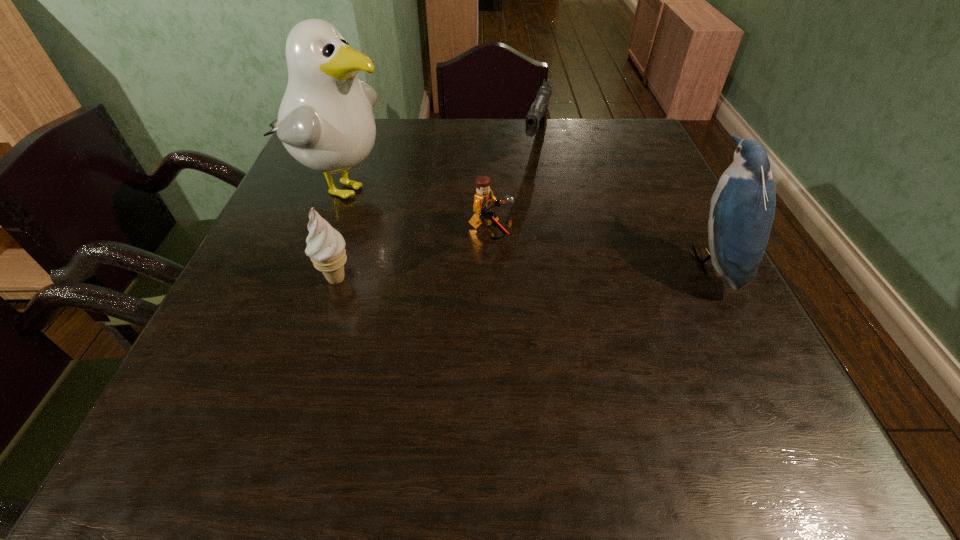
The height and width of the screenshot is (540, 960). In order to click on vacant area situated in the direction the fourth object from left to right is aimed in this screenshot , I will do `click(525, 186)`.

Locate an element on the screen. vacant space located 0.310m in the direction the fourth object from left to right is aimed is located at coordinates (506, 237).

Where is `free spot located 0.120m in the direction the fourth object from left to right is aimed`? free spot located 0.120m in the direction the fourth object from left to right is aimed is located at coordinates (524, 188).

Locate an element on the screen. The image size is (960, 540). free space located holding a crossbow in the hands of the Lego is located at coordinates (588, 276).

Where is `free space located 0.250m holding a crossbow in the hands of the Lego`? The width and height of the screenshot is (960, 540). free space located 0.250m holding a crossbow in the hands of the Lego is located at coordinates (622, 291).

The width and height of the screenshot is (960, 540). In order to click on vacant space located holding a crossbow in the hands of the Lego in this screenshot , I will do `click(534, 254)`.

Where is `vacant point located on the beak of the tallest object`? This screenshot has width=960, height=540. vacant point located on the beak of the tallest object is located at coordinates (417, 212).

What are the coordinates of `free location located on the beak of the tallest object` in the screenshot? It's located at (489, 238).

Image resolution: width=960 pixels, height=540 pixels. What are the coordinates of `vacant space located on the beak of the tallest object` in the screenshot? It's located at (514, 247).

Image resolution: width=960 pixels, height=540 pixels. Identify the location of gun that is at the far edge. (536, 120).